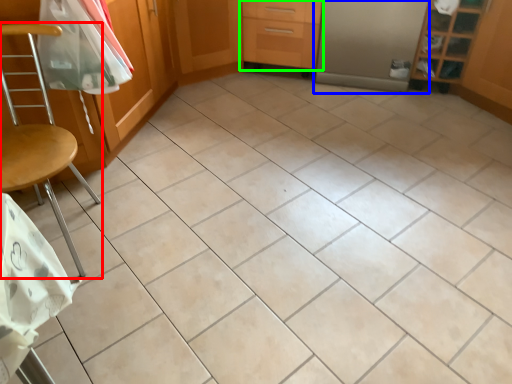
Question: Considering the real-world distances, which object is closest to chair (highlighted by a red box)? screen door (highlighted by a blue box) or drawer (highlighted by a green box).

Choices:
 (A) screen door
 (B) drawer

Answer: (B)